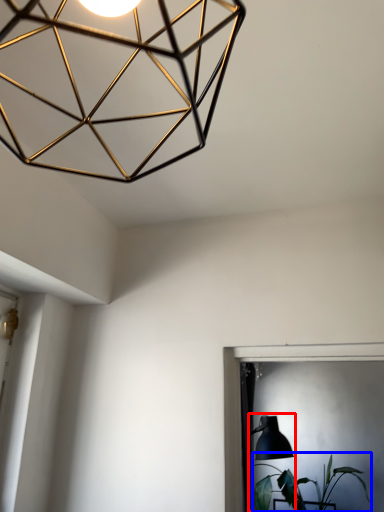
Question: Which object appears closest to the camera in this image, table lamp (highlighted by a red box) or houseplant (highlighted by a blue box)?

Choices:
 (A) table lamp
 (B) houseplant

Answer: (A)